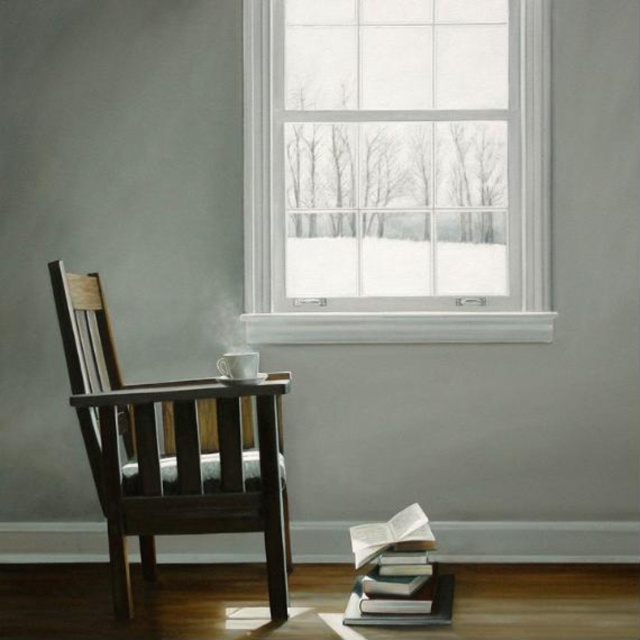
Is white glass window at upper center shorter than dark wood armchair at left?

No, white glass window at upper center is not shorter than dark wood armchair at left.

Between white glass window at upper center and dark wood armchair at left, which one has less height?

dark wood armchair at left is shorter.

At what (x,y) coordinates should I click in order to perform the action: click on white glass window at upper center. Please return your answer as a coordinate pair (x, y). Looking at the image, I should click on (396, 170).

Locate an element on the screen. white glass window at upper center is located at coordinates (396, 170).

Who is shorter, white glass window at upper center or hardcover books at lower right?

hardcover books at lower right is shorter.

Does white glass window at upper center have a greater height compared to hardcover books at lower right?

Indeed, white glass window at upper center has a greater height compared to hardcover books at lower right.

Find the location of a particular element. white glass window at upper center is located at coordinates (396, 170).

Who is shorter, dark wood armchair at left or hardcover books at lower right?

hardcover books at lower right

Who is positioned more to the right, dark wood armchair at left or hardcover books at lower right?

hardcover books at lower right is more to the right.

Does point (74, 339) lie behind point (392, 556)?

No, (74, 339) is in front of (392, 556).

At what (x,y) coordinates should I click in order to perform the action: click on dark wood armchair at left. Please return your answer as a coordinate pair (x, y). The width and height of the screenshot is (640, 640). Looking at the image, I should click on (172, 445).